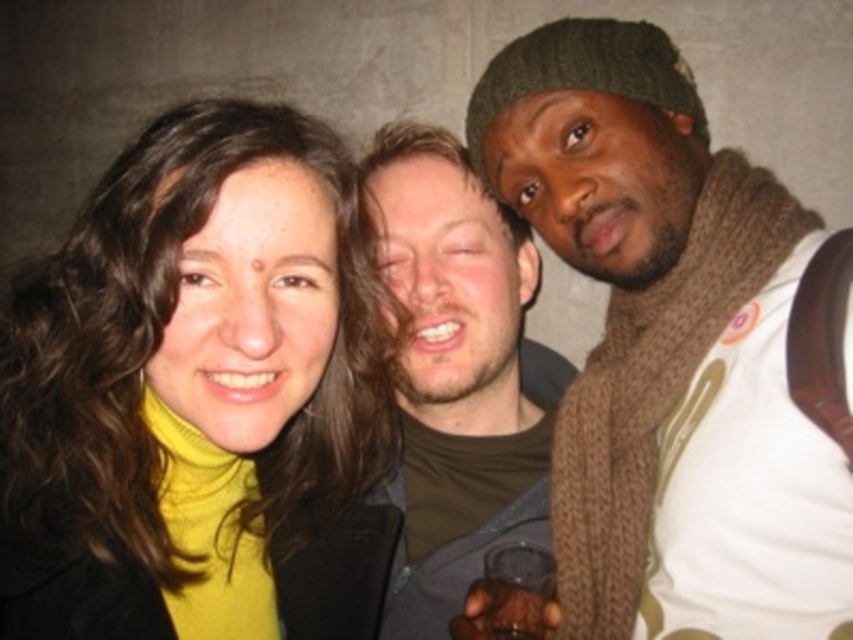
Question: Estimate the real-world distances between objects in this image. Which object is farther from the brown knitted scarf at right?

Choices:
 (A) matte brown hair at center
 (B) yellow turtleneck sweater at left

Answer: (B)

Question: Is yellow turtleneck sweater at left wider than matte brown hair at center?

Choices:
 (A) yes
 (B) no

Answer: (A)

Question: Can you confirm if yellow turtleneck sweater at left is positioned to the right of brown knitted scarf at right?

Choices:
 (A) yes
 (B) no

Answer: (B)

Question: Which object appears farthest from the camera in this image?

Choices:
 (A) brown knitted scarf at right
 (B) matte brown hair at center

Answer: (B)

Question: Is brown knitted scarf at right thinner than matte brown hair at center?

Choices:
 (A) yes
 (B) no

Answer: (B)

Question: Which point is farther from the camera taking this photo?

Choices:
 (A) (514, 506)
 (B) (358, 481)
 (C) (494, 99)

Answer: (A)